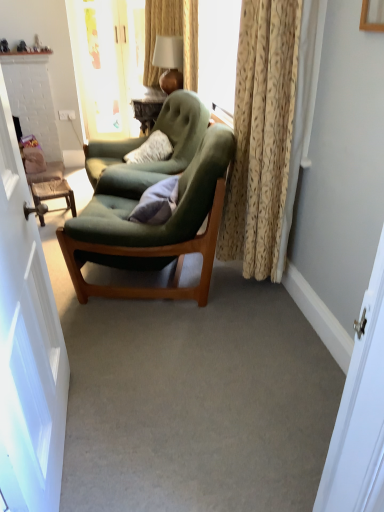
Question: From the image's perspective, is beige textured curtain at right on white glossy door at left?

Choices:
 (A) no
 (B) yes

Answer: (B)

Question: Is beige textured curtain at right turned away from white glossy door at left?

Choices:
 (A) no
 (B) yes

Answer: (A)

Question: Can you confirm if beige textured curtain at right is positioned to the left of white glossy door at left?

Choices:
 (A) yes
 (B) no

Answer: (B)

Question: Does beige textured curtain at right come behind white glossy door at left?

Choices:
 (A) yes
 (B) no

Answer: (A)

Question: From a real-world perspective, is beige textured curtain at right located higher than white glossy door at left?

Choices:
 (A) yes
 (B) no

Answer: (A)

Question: Is beige textured curtain at right shorter than white glossy door at left?

Choices:
 (A) no
 (B) yes

Answer: (B)

Question: Is the position of beige textured curtain at right less distant than that of velvet green armchair at center, the 1th chair from the front?

Choices:
 (A) no
 (B) yes

Answer: (B)

Question: From a real-world perspective, is beige textured curtain at right below velvet green armchair at center, the 1th chair from the front?

Choices:
 (A) yes
 (B) no

Answer: (B)

Question: Is beige textured curtain at right in contact with velvet green armchair at center, the 1th chair from the front?

Choices:
 (A) yes
 (B) no

Answer: (B)

Question: Considering the relative sizes of beige textured curtain at right and velvet green armchair at center, the 2th chair viewed from the back, in the image provided, is beige textured curtain at right taller than velvet green armchair at center, the 2th chair viewed from the back,?

Choices:
 (A) yes
 (B) no

Answer: (A)

Question: From the image's perspective, is beige textured curtain at right above velvet green armchair at center, the 2th chair viewed from the back?

Choices:
 (A) no
 (B) yes

Answer: (B)

Question: Is beige textured curtain at right bigger than velvet green armchair at center, the 1th chair from the front?

Choices:
 (A) no
 (B) yes

Answer: (A)

Question: Is beige textured curtain at right to the right of velvet green armchair at center, which is the first chair in back-to-front order, from the viewer's perspective?

Choices:
 (A) yes
 (B) no

Answer: (A)